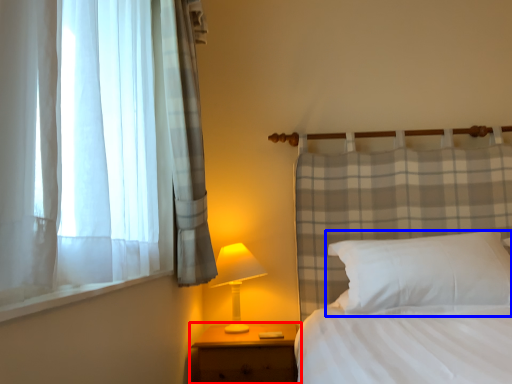
Question: Which point is further to the camera, nightstand (highlighted by a red box) or pillow (highlighted by a blue box)?

Choices:
 (A) nightstand
 (B) pillow

Answer: (A)